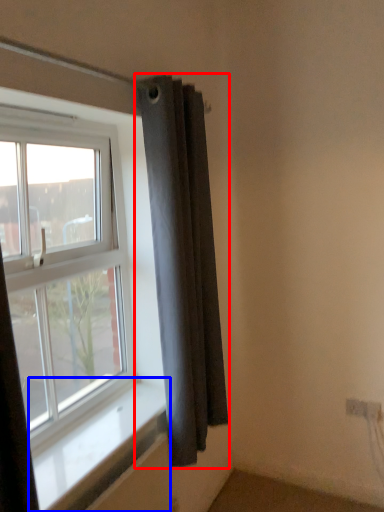
Question: Which object appears farthest to the camera in this image, curtain (highlighted by a red box) or window sill (highlighted by a blue box)?

Choices:
 (A) curtain
 (B) window sill

Answer: (A)